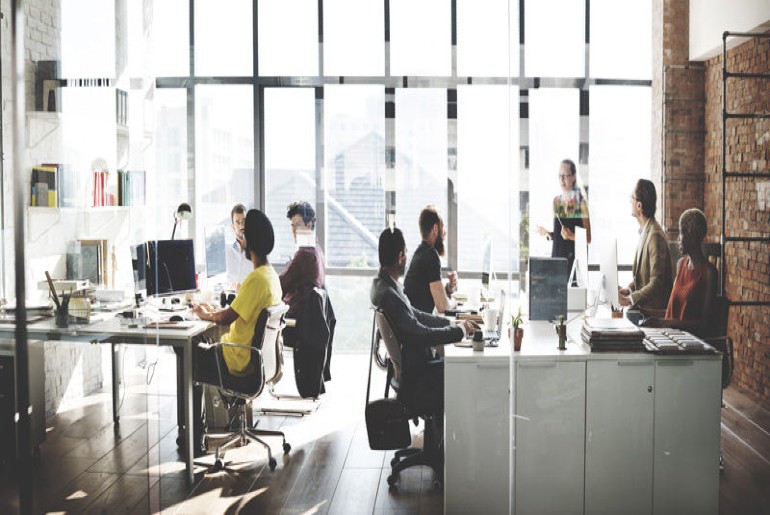
Find the location of `wheels on rolling chairs`. wheels on rolling chairs is located at coordinates (390, 460), (390, 480), (439, 485), (286, 446), (273, 463), (219, 463), (199, 446).